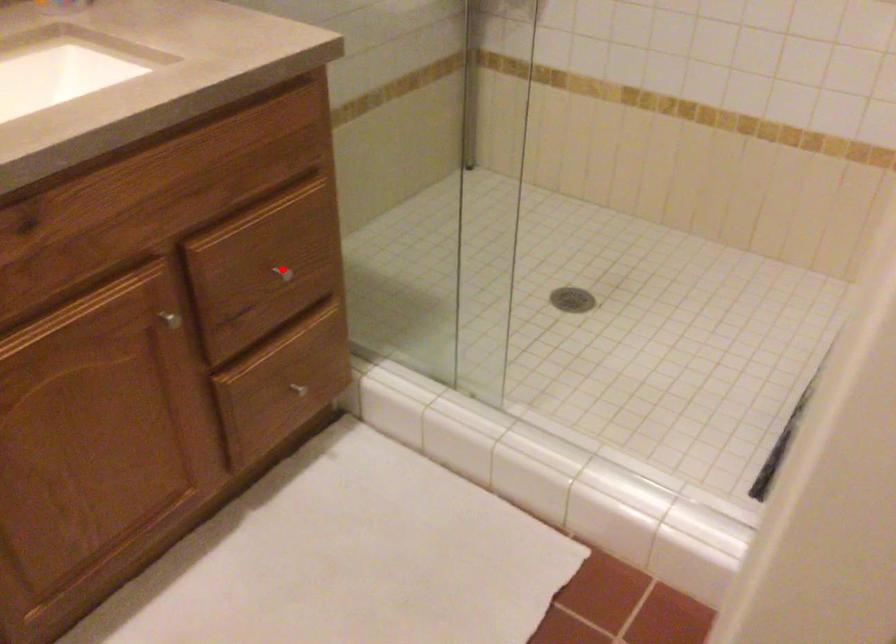
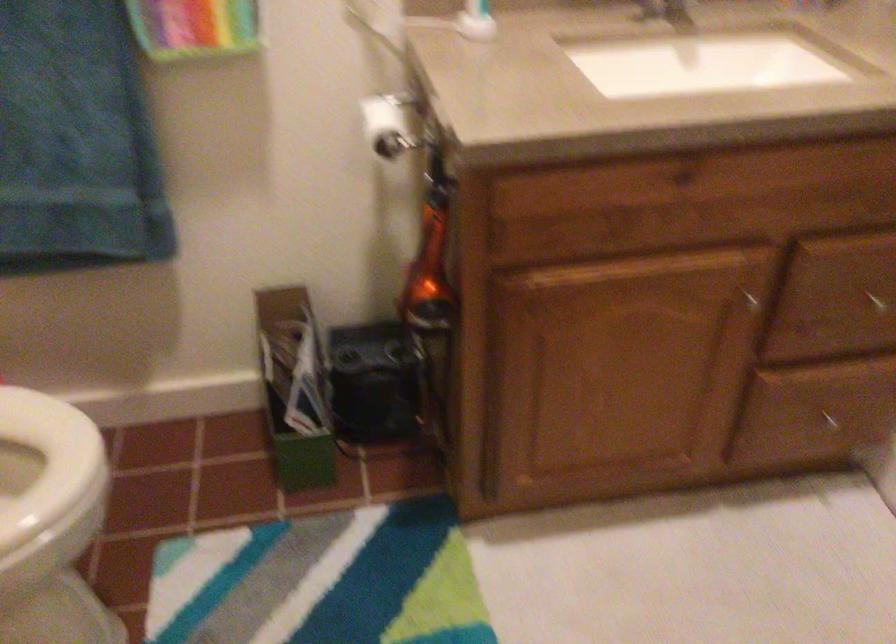
Question: I am providing you with two images of the same scene from different viewpoints. A red point is marked on the first image. At the location where the point appears in image 1, is it still visible in image 2?

Choices:
 (A) Yes
 (B) No

Answer: (A)